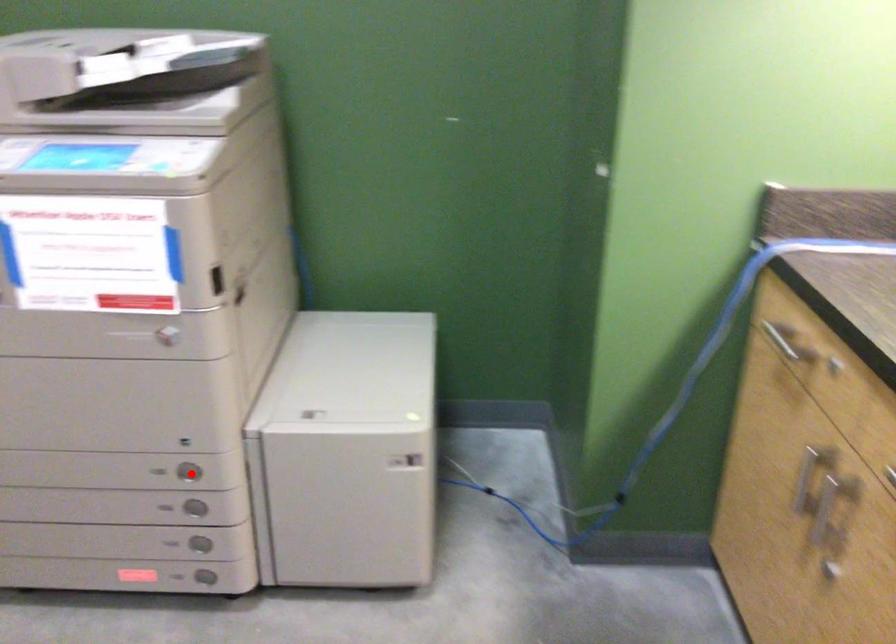
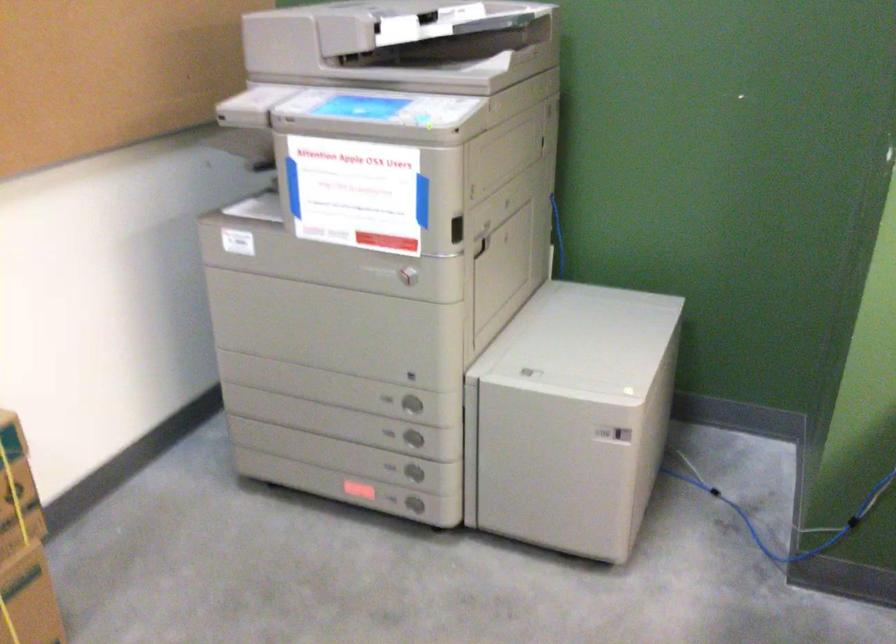
Locate, in the second image, the point that corresponds to the highlighted location in the first image.

(411, 404)